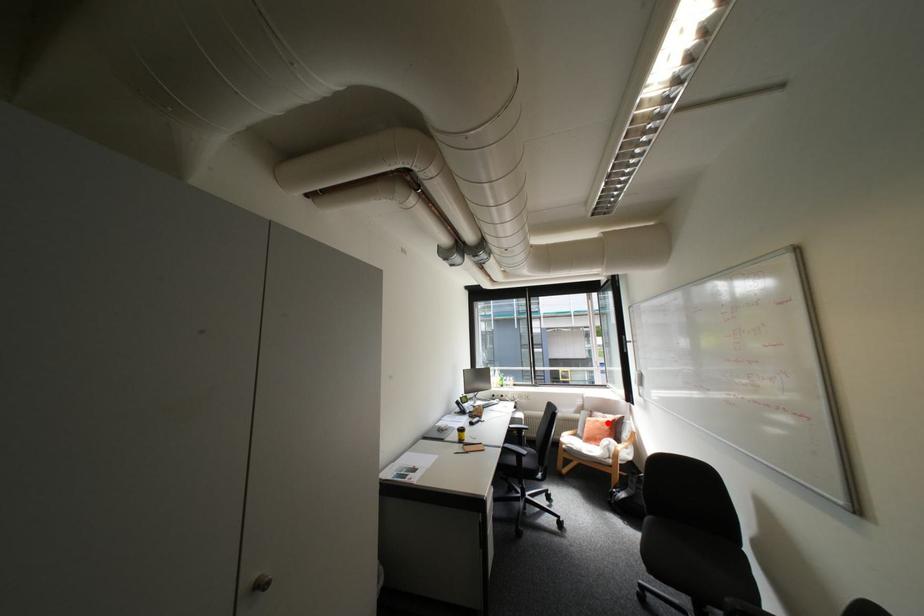
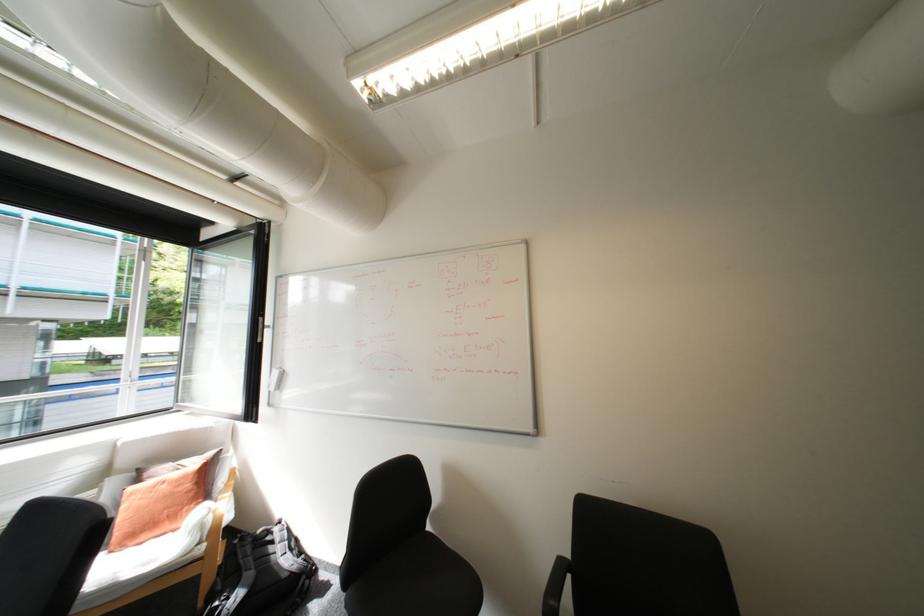
Question: I am providing you with two images of the same scene from different viewpoints. Given a red point in image1, look at the same physical point in image2. Is it:

Choices:
 (A) Closer to the viewpoint
 (B) Farther from the viewpoint

Answer: (A)